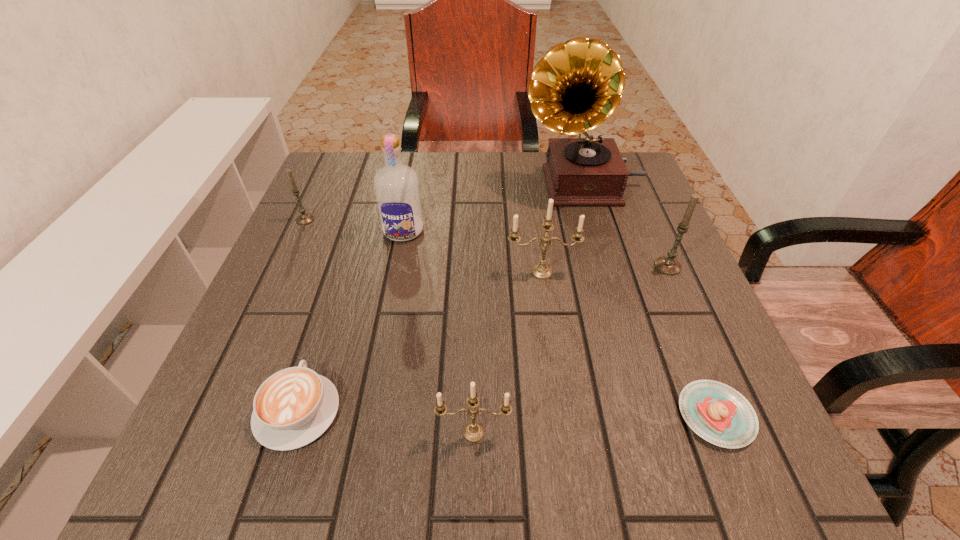
Where is `free space that satisfies the following two spatial constraints: 1. from the horn of the phonograph record; 2. on the back side of the shortest object`? This screenshot has height=540, width=960. free space that satisfies the following two spatial constraints: 1. from the horn of the phonograph record; 2. on the back side of the shortest object is located at coordinates (648, 415).

The image size is (960, 540). I want to click on vacant space that satisfies the following two spatial constraints: 1. on the back side of the bigger gray candle; 2. from the horn of the phonograph record, so click(633, 185).

The image size is (960, 540). In order to click on vacant area in the image that satisfies the following two spatial constraints: 1. on the label of the vodka; 2. on the right side of the left metallic candle in this screenshot , I will do `click(365, 432)`.